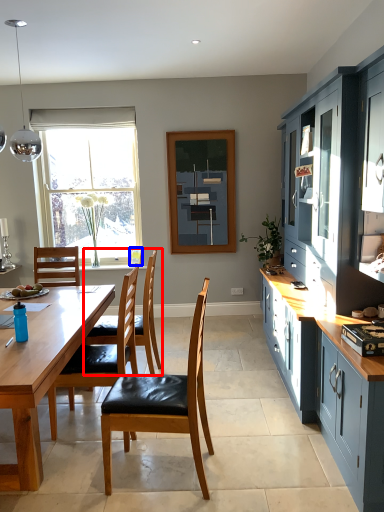
Question: Which object appears closest to the camera in this image, chair (highlighted by a red box) or picture frame (highlighted by a blue box)?

Choices:
 (A) chair
 (B) picture frame

Answer: (A)